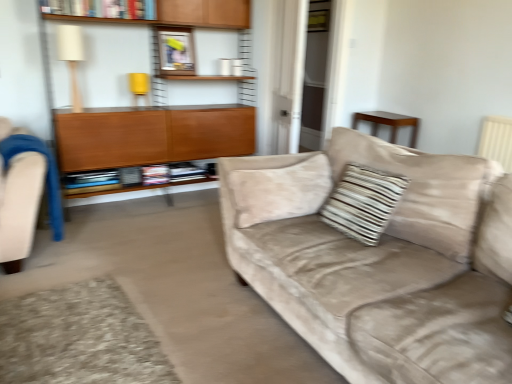
The height and width of the screenshot is (384, 512). Identify the location of empty space that is ontop of metallic silver picture frame at upper center. (178, 22).